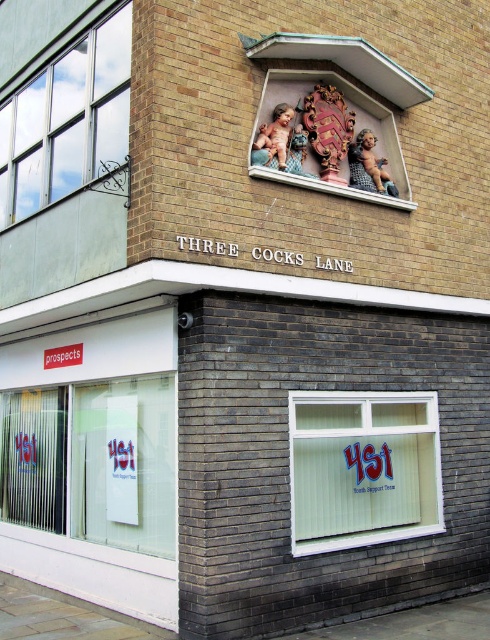
You are a delivery person approaching the building and need to access the entrance. The entrance is located behind the white plastic shop window at lower right and the metallic glass window at upper left. Which window should you go around to reach the entrance?

The entrance is behind both windows, but since the white plastic shop window at lower right is in front of the metallic glass window at upper left, you should go around the white plastic shop window at lower right to access the entrance.